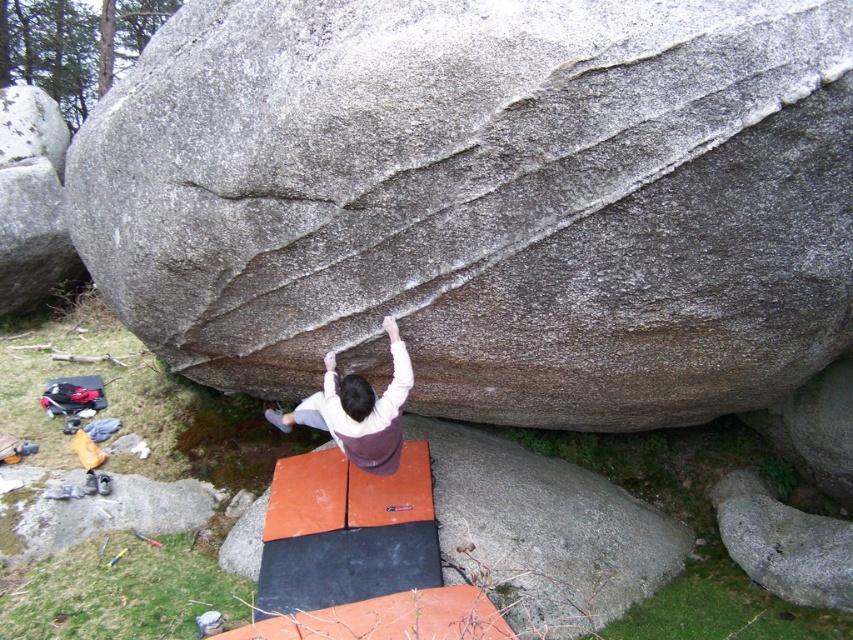
Does gray textured rock at center have a lesser width compared to white matte shirt at center?

No, gray textured rock at center is not thinner than white matte shirt at center.

What do you see at coordinates (485, 198) in the screenshot?
I see `gray textured rock at center` at bounding box center [485, 198].

Which is behind, point (648, 336) or point (357, 422)?

Point (357, 422)

Where is `gray textured rock at center`? This screenshot has width=853, height=640. gray textured rock at center is located at coordinates (485, 198).

What do you see at coordinates (544, 532) in the screenshot? I see `orange rubber mat at center` at bounding box center [544, 532].

Is point (457, 561) more distant than point (387, 448)?

That is False.

Where is `orange rubber mat at center`? The image size is (853, 640). orange rubber mat at center is located at coordinates (544, 532).

Who is positioned more to the right, gray textured rock at center or orange rubber mat at center?

orange rubber mat at center

At what (x,y) coordinates should I click in order to perform the action: click on gray textured rock at center. Please return your answer as a coordinate pair (x, y). Image resolution: width=853 pixels, height=640 pixels. Looking at the image, I should click on (485, 198).

The image size is (853, 640). I want to click on gray textured rock at center, so click(485, 198).